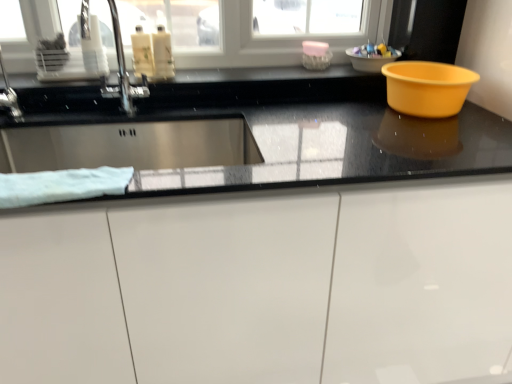
Question: From a real-world perspective, is white soft towel at left on top of translucent plastic bottles at upper center, the 2th liquid when ordered from right to left?

Choices:
 (A) yes
 (B) no

Answer: (B)

Question: Could you tell me if white soft towel at left is facing translucent plastic bottles at upper center, the 2th liquid when ordered from right to left?

Choices:
 (A) no
 (B) yes

Answer: (A)

Question: Considering the relative sizes of white soft towel at left and translucent plastic bottles at upper center, the 2th liquid when ordered from right to left, in the image provided, is white soft towel at left wider than translucent plastic bottles at upper center, the 2th liquid when ordered from right to left,?

Choices:
 (A) no
 (B) yes

Answer: (B)

Question: Can you confirm if white soft towel at left is thinner than translucent plastic bottles at upper center, the 2th liquid when ordered from right to left?

Choices:
 (A) yes
 (B) no

Answer: (B)

Question: Considering the relative positions of white soft towel at left and translucent plastic bottles at upper center, the 2th liquid when ordered from right to left, in the image provided, is white soft towel at left to the left of translucent plastic bottles at upper center, the 2th liquid when ordered from right to left, from the viewer's perspective?

Choices:
 (A) no
 (B) yes

Answer: (B)

Question: From a real-world perspective, relative to metallic faucet at upper left, is pink translucent soap at upper center vertically above or below?

Choices:
 (A) below
 (B) above

Answer: (A)

Question: Looking at the image, does pink translucent soap at upper center seem bigger or smaller compared to metallic faucet at upper left?

Choices:
 (A) small
 (B) big

Answer: (A)

Question: Looking at their shapes, would you say pink translucent soap at upper center is wider or thinner than metallic faucet at upper left?

Choices:
 (A) thin
 (B) wide

Answer: (A)

Question: Is point (312, 56) positioned closer to the camera than point (124, 69)?

Choices:
 (A) farther
 (B) closer

Answer: (A)

Question: Is point (156, 46) positioned closer to the camera than point (125, 77)?

Choices:
 (A) closer
 (B) farther

Answer: (A)

Question: From the image's perspective, is translucent plastic bottles at upper center, which is the 1th liquid in right-to-left order, positioned above or below metallic faucet at upper left?

Choices:
 (A) above
 (B) below

Answer: (A)

Question: Is translucent plastic bottles at upper center, which is the 1th liquid in right-to-left order, bigger or smaller than metallic faucet at upper left?

Choices:
 (A) small
 (B) big

Answer: (A)

Question: From a real-world perspective, is translucent plastic bottles at upper center, which ranks as the 2th liquid in left-to-right order, positioned above or below metallic faucet at upper left?

Choices:
 (A) below
 (B) above

Answer: (B)

Question: From a real-world perspective, relative to plastic bowl at upper right, is translucent plastic bottles at upper center, the 2th liquid when ordered from right to left, vertically above or below?

Choices:
 (A) below
 (B) above

Answer: (B)

Question: From the image's perspective, is translucent plastic bottles at upper center, the 2th liquid when ordered from right to left, positioned above or below plastic bowl at upper right?

Choices:
 (A) above
 (B) below

Answer: (B)